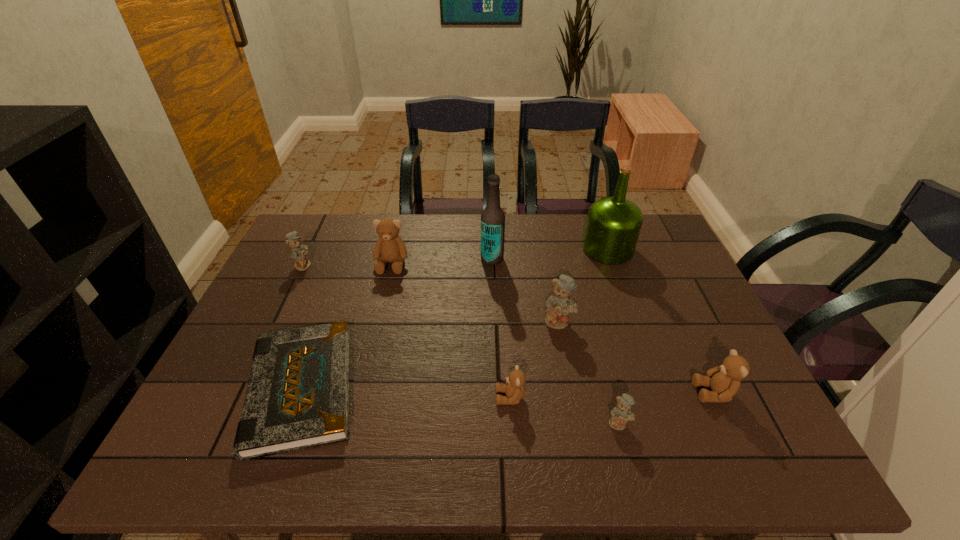
Identify the location of free space located on the front-facing side of the second nearest blue teddy bear. (566, 361).

The width and height of the screenshot is (960, 540). I want to click on free space located 0.330m on the face of the fifth teddy bear from right to left, so click(x=369, y=363).

What are the coordinates of `vacant region located 0.310m on the front-facing side of the leftmost teddy bear` in the screenshot? It's located at (413, 265).

Identify the location of blank area located on the face of the rightmost object. The height and width of the screenshot is (540, 960). (651, 393).

This screenshot has height=540, width=960. Identify the location of vacant space located 0.150m on the face of the rightmost object. (630, 393).

Identify the location of vacant space positioned 0.210m on the face of the rightmost object. The image size is (960, 540). (604, 393).

Locate an element on the screen. This screenshot has width=960, height=540. free space located 0.270m on the face of the third teddy bear from left to right is located at coordinates (377, 397).

This screenshot has width=960, height=540. I want to click on free space located 0.330m on the face of the third teddy bear from left to right, so click(351, 397).

Where is `vacant area situated on the face of the third teddy bear from left to right`? This screenshot has height=540, width=960. vacant area situated on the face of the third teddy bear from left to right is located at coordinates (399, 397).

Image resolution: width=960 pixels, height=540 pixels. In order to click on vacant position located 0.050m on the front-facing side of the second teddy bear from right to left in this screenshot , I will do `click(627, 454)`.